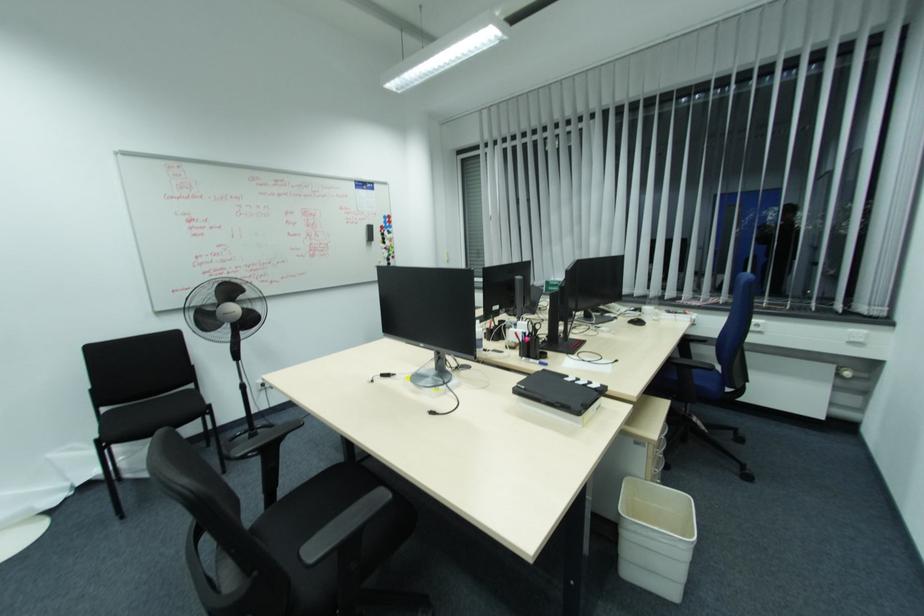
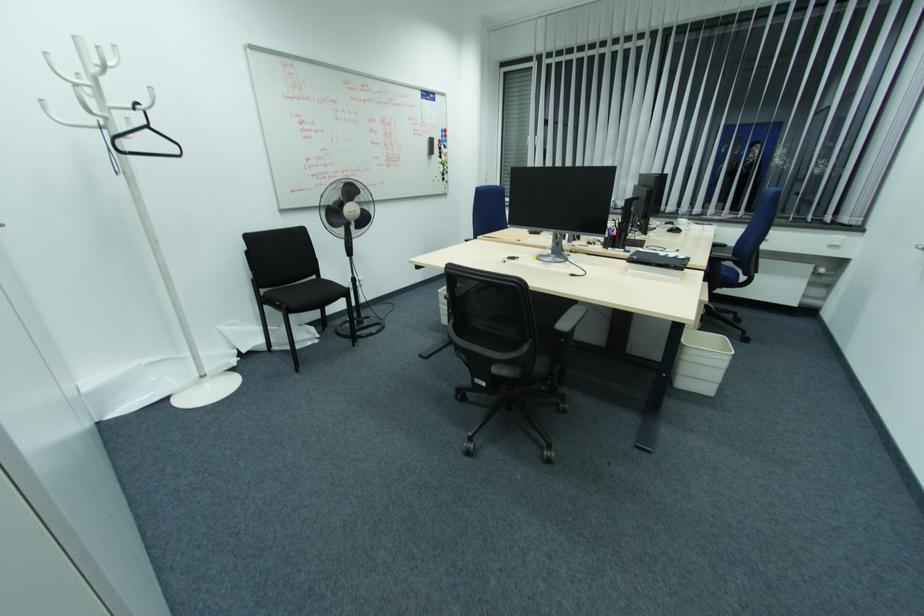
Find the pixel in the second image that matches point (390, 229) in the first image.

(445, 144)